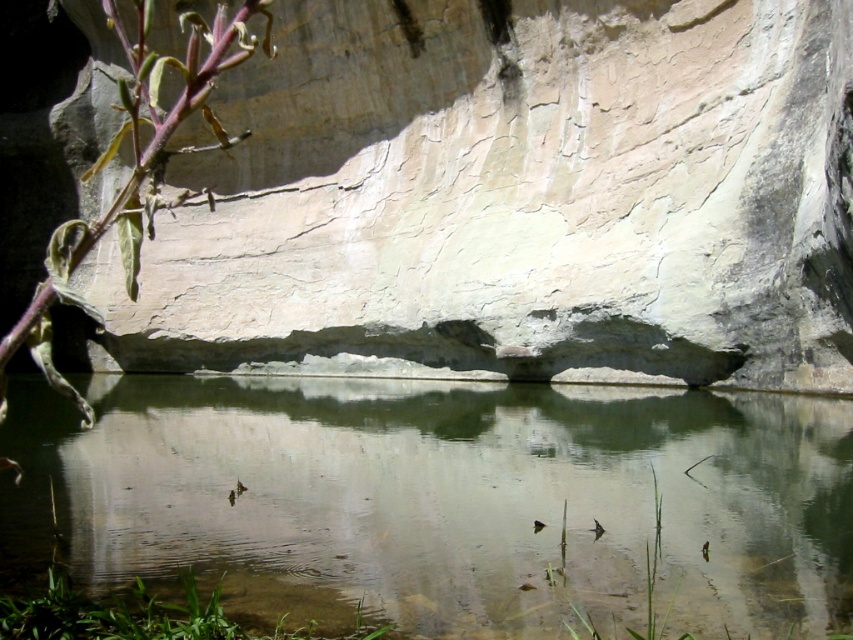
You are standing at the edge of the scene and want to walk from the green leafy plant at lower left to the clear water at center. Which direction should you move in?

You should move to the right to reach the clear water at center from the green leafy plant at lower left since the clear water at center is located to the right of the green leafy plant at lower left.

You are standing at the edge of the scene and want to reach the green leafy plant at lower left. To get there, you must walk around the clear water at center. Which direction should you go to avoid the water?

Since the green leafy plant at lower left is behind the clear water at center, you should walk around the clear water at center towards the left side to reach the green leafy plant at lower left without stepping into the water.